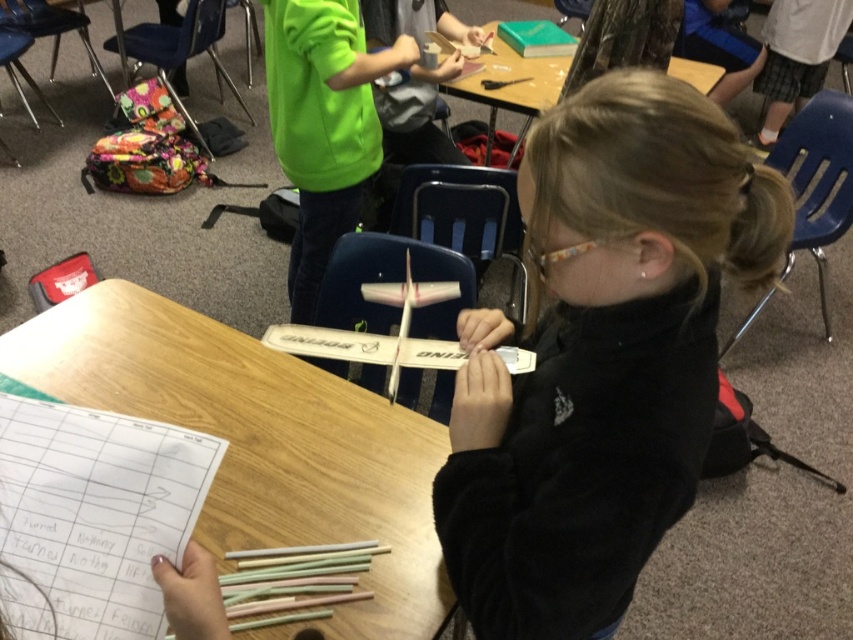
Can you confirm if wooden table at center is wider than white paper at upper left?

Correct, the width of wooden table at center exceeds that of white paper at upper left.

Between point (409, 621) and point (24, 541), which one is positioned behind?

Positioned behind is point (409, 621).

Measure the distance between wooden table at center and camera.

wooden table at center is 3.67 feet away from camera.

This screenshot has height=640, width=853. I want to click on wooden table at center, so click(260, 440).

Does black matte airplane at center have a greater height compared to green matte book at upper center?

Yes, black matte airplane at center is taller than green matte book at upper center.

From the picture: Does black matte airplane at center appear under green matte book at upper center?

Correct, black matte airplane at center is located below green matte book at upper center.

Which is in front, point (677, 470) or point (566, 60)?

Positioned in front is point (677, 470).

Find the location of `black matte airplane at center`. black matte airplane at center is located at coordinates (601, 355).

This screenshot has width=853, height=640. Identify the location of black matte airplane at center. (601, 355).

I want to click on black matte airplane at center, so click(x=601, y=355).

Where is `black matte airplane at center`? The width and height of the screenshot is (853, 640). black matte airplane at center is located at coordinates (601, 355).